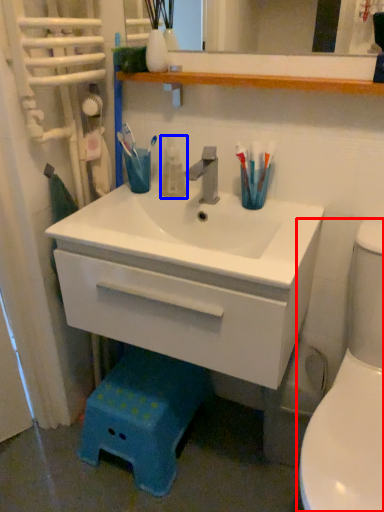
Question: Which point is further to the camera, toilet (highlighted by a red box) or mouthwash (highlighted by a blue box)?

Choices:
 (A) toilet
 (B) mouthwash

Answer: (B)